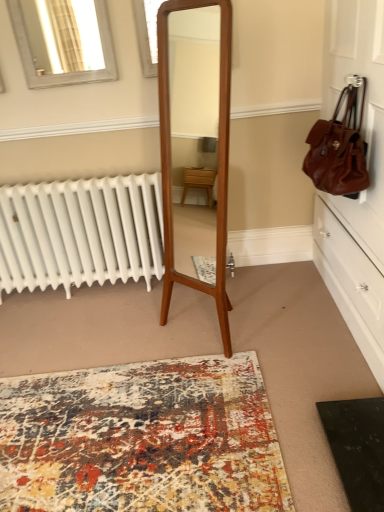
Question: Is brown leather handbag at upper right oriented away from matte glass window at upper center, which is counted as the second window, starting from the left?

Choices:
 (A) yes
 (B) no

Answer: (B)

Question: Is brown leather handbag at upper right in contact with matte glass window at upper center, the first window from the right?

Choices:
 (A) no
 (B) yes

Answer: (A)

Question: Is brown leather handbag at upper right shorter than matte glass window at upper center, which is counted as the second window, starting from the left?

Choices:
 (A) no
 (B) yes

Answer: (A)

Question: Is brown leather handbag at upper right taller than matte glass window at upper center, the first window from the right?

Choices:
 (A) yes
 (B) no

Answer: (A)

Question: From a real-world perspective, is brown leather handbag at upper right on matte glass window at upper center, the first window from the right?

Choices:
 (A) yes
 (B) no

Answer: (B)

Question: Do you think brown leather handbag at upper right is within matte brown leather dresser at right, or outside of it?

Choices:
 (A) inside
 (B) outside

Answer: (A)

Question: Based on their positions, is brown leather handbag at upper right located to the left or right of matte brown leather dresser at right?

Choices:
 (A) left
 (B) right

Answer: (A)

Question: Considering the positions of point (362, 109) and point (374, 306), is point (362, 109) closer or farther from the camera than point (374, 306)?

Choices:
 (A) farther
 (B) closer

Answer: (B)

Question: In the image, is brown leather handbag at upper right positioned in front of or behind matte brown leather dresser at right?

Choices:
 (A) behind
 (B) front

Answer: (A)

Question: Which is correct: brown leather handbag at upper right is inside matte glass window at upper center, which is counted as the second window, starting from the left, or outside of it?

Choices:
 (A) outside
 (B) inside

Answer: (A)

Question: Considering the relative positions of brown leather handbag at upper right and matte glass window at upper center, which is counted as the second window, starting from the left, in the image provided, is brown leather handbag at upper right to the left or to the right of matte glass window at upper center, which is counted as the second window, starting from the left,?

Choices:
 (A) left
 (B) right

Answer: (B)

Question: Is point (355, 103) positioned closer to the camera than point (155, 45)?

Choices:
 (A) farther
 (B) closer

Answer: (A)

Question: From a real-world perspective, is brown leather handbag at upper right physically located above or below matte glass window at upper center, the first window from the right?

Choices:
 (A) below
 (B) above

Answer: (A)

Question: Does point (380, 47) appear closer or farther from the camera than point (112, 56)?

Choices:
 (A) closer
 (B) farther

Answer: (A)

Question: From a real-world perspective, is matte brown leather dresser at right physically located above or below silver metallic window at upper left, which is the first window from left to right?

Choices:
 (A) above
 (B) below

Answer: (B)